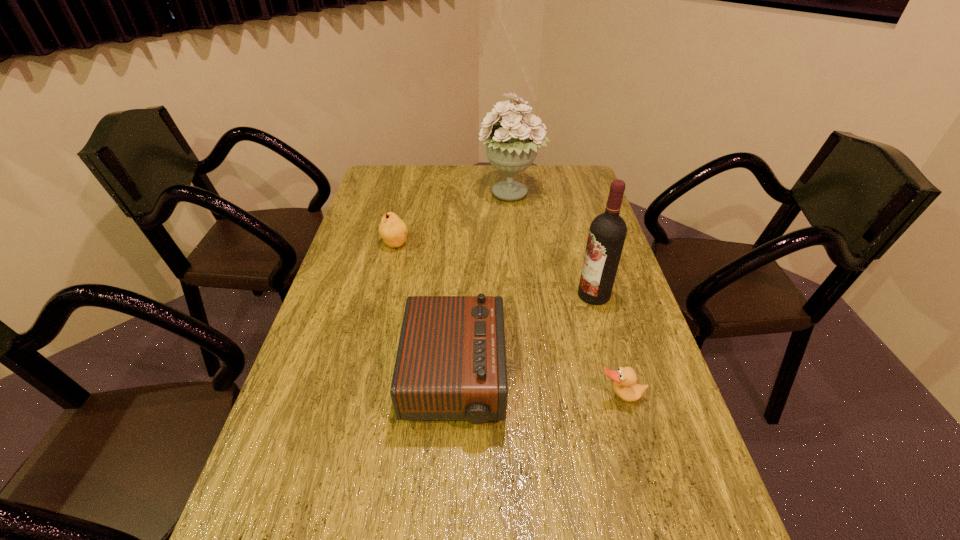
Select which object appears as the closest to the duck. Please provide its 2D coordinates. Your answer should be formatted as a tuple, i.e. [(x, y)], where the tuple contains the x and y coordinates of a point satisfying the conditions above.

[(451, 364)]

Locate an element on the screen. object that is the fourth closest to the third tallest object is located at coordinates (511, 147).

What are the coordinates of `vacant area that satisfies the following two spatial constraints: 1. on the back side of the second farthest object; 2. on the left side of the bouquet` in the screenshot? It's located at (407, 194).

This screenshot has height=540, width=960. In order to click on free location that satisfies the following two spatial constraints: 1. on the front side of the farthest object; 2. on the front panel of the third shortest object in this screenshot , I will do `click(529, 379)`.

At what (x,y) coordinates should I click in order to perform the action: click on vacant area in the image that satisfies the following two spatial constraints: 1. on the label of the wine bottle; 2. on the beak of the shortest object. Please return your answer as a coordinate pair (x, y). This screenshot has width=960, height=540. Looking at the image, I should click on (x=623, y=396).